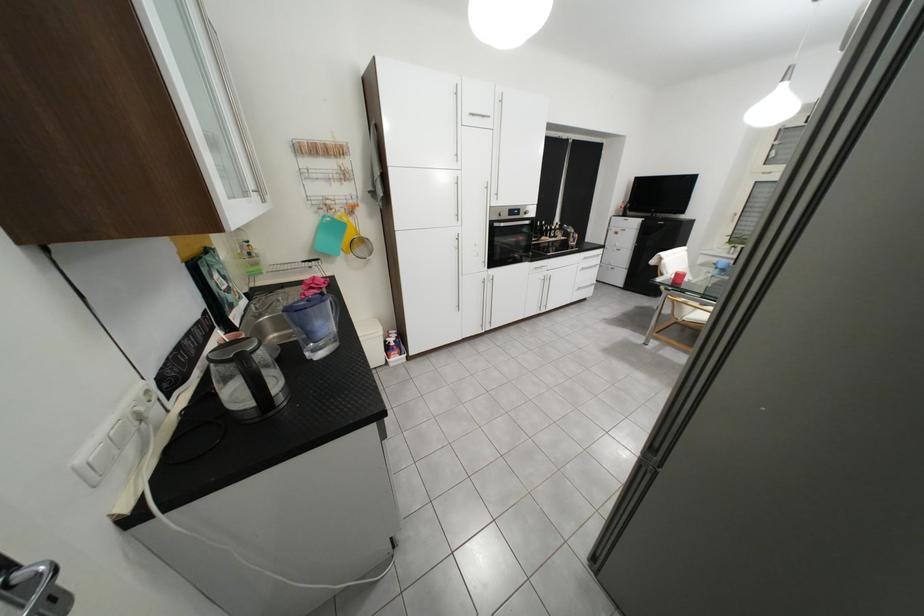
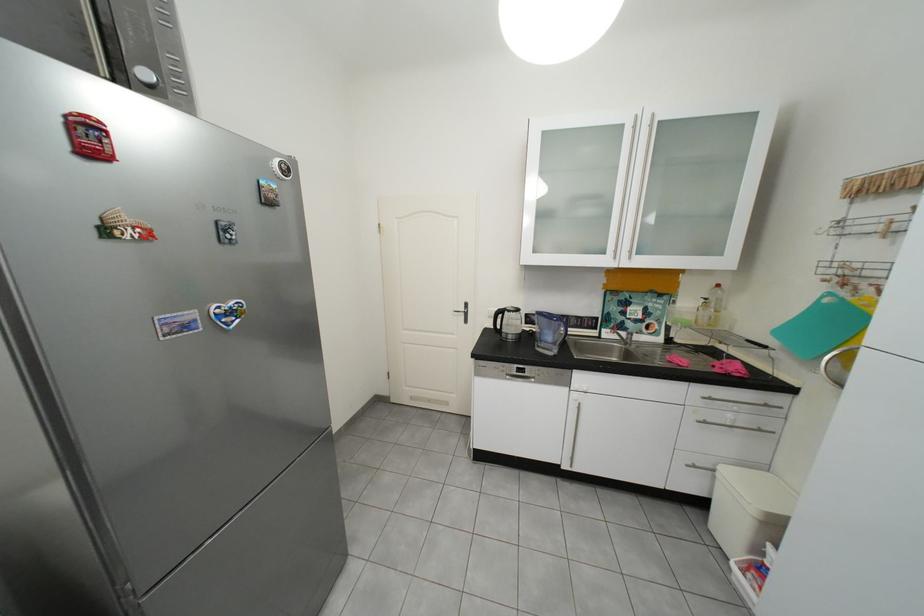
The point at [335,217] is marked in the first image. Where is the corresponding point in the second image?

(841, 296)